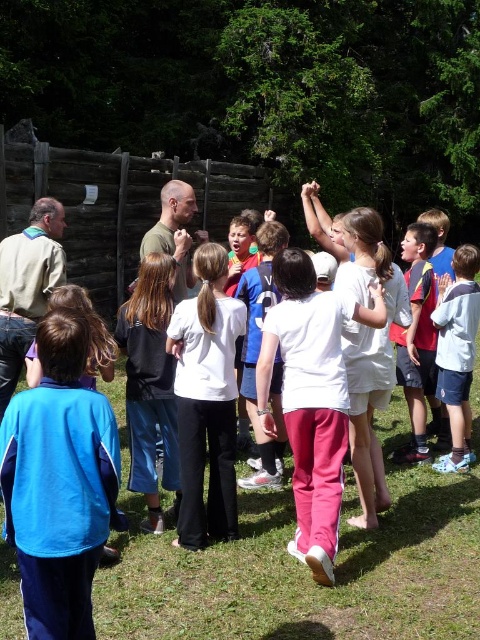
Question: Is blue fabric jacket at lower left behind white cotton shirt at center?

Choices:
 (A) yes
 (B) no

Answer: (B)

Question: Does black fabric jacket at center appear on the left side of white cotton shirt at center?

Choices:
 (A) yes
 (B) no

Answer: (A)

Question: Which of these objects is positioned closest to the black fabric jacket at center?

Choices:
 (A) white cotton shirt at center
 (B) white matte shirt at center

Answer: (B)

Question: Which point is farther from the camera taking this photo?

Choices:
 (A) (199, 506)
 (B) (121, 324)
 (C) (100, 541)

Answer: (B)

Question: Is blue fabric jacket at lower left below black fabric jacket at center?

Choices:
 (A) yes
 (B) no

Answer: (A)

Question: Which point is closer to the camera taking this photo?

Choices:
 (A) (157, 364)
 (B) (25, 524)
 (C) (228, 428)
 (D) (463, 365)

Answer: (B)